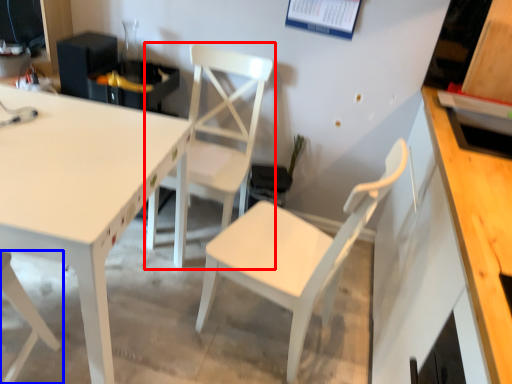
Question: Which object appears farthest to the camera in this image, chair (highlighted by a red box) or chair (highlighted by a blue box)?

Choices:
 (A) chair
 (B) chair

Answer: (A)